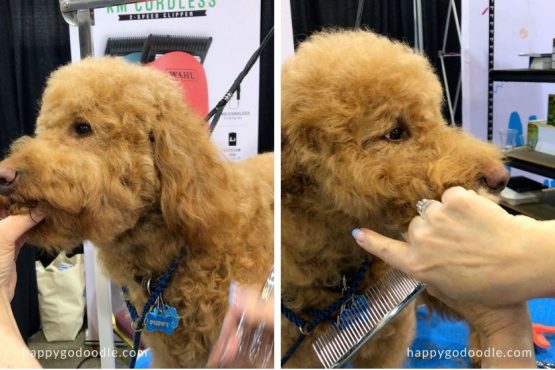
Where is `objects on shelf`? This screenshot has width=555, height=370. objects on shelf is located at coordinates (519, 132), (531, 132), (542, 59).